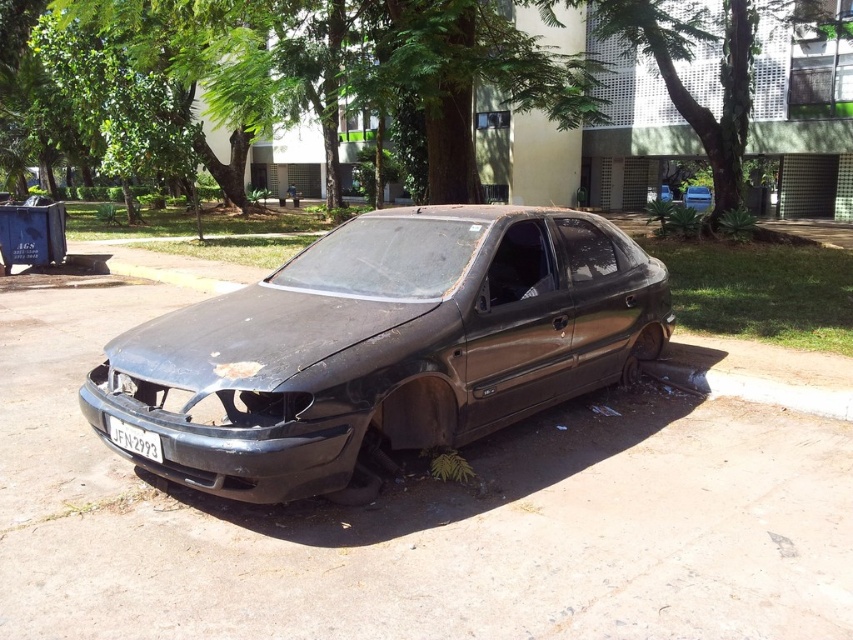
Question: Which of the following is the farthest from the observer?

Choices:
 (A) (125, 435)
 (B) (624, 179)
 (C) (102, 419)
 (D) (647, 358)

Answer: (B)

Question: Considering the real-world distances, which object is closest to the dull metallic car at center?

Choices:
 (A) black matte license plate at lower center
 (B) green leafy tree at center
 (C) rusty metal tire at lower right

Answer: (A)

Question: Where is green leafy tree at center located in relation to rusty metal tire at lower right in the image?

Choices:
 (A) above
 (B) below

Answer: (A)

Question: Can you confirm if dull metallic car at center is thinner than black matte license plate at lower center?

Choices:
 (A) yes
 (B) no

Answer: (B)

Question: Can you confirm if black matte license plate at lower center is positioned above rusty metal tire at lower right?

Choices:
 (A) yes
 (B) no

Answer: (B)

Question: Among these objects, which one is farthest from the camera?

Choices:
 (A) black matte license plate at lower center
 (B) dull metallic car at center
 (C) green leafy tree at center
 (D) rusty metal tire at lower right

Answer: (C)